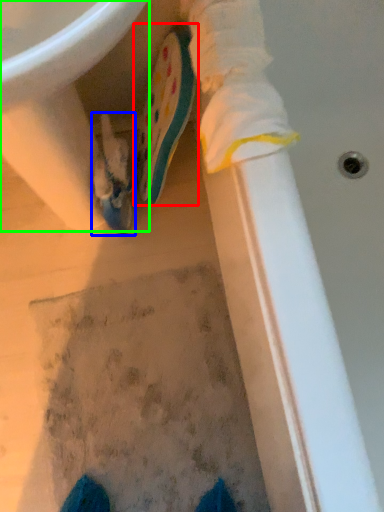
Question: Which is nearer to the footwear (highlighted by a red box)? footwear (highlighted by a blue box) or sink (highlighted by a green box).

Choices:
 (A) footwear
 (B) sink

Answer: (A)